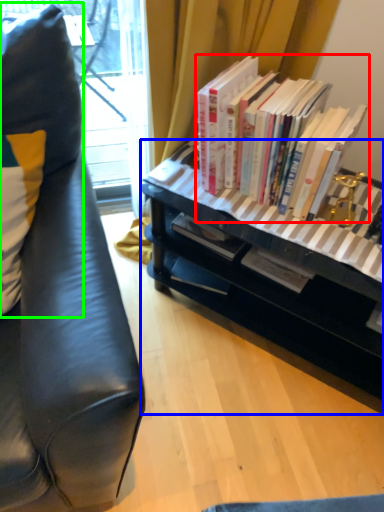
Question: Which object is positioned closest to book (highlighted by a red box)? Select from desk (highlighted by a blue box) and pillow (highlighted by a green box).

Choices:
 (A) desk
 (B) pillow

Answer: (A)